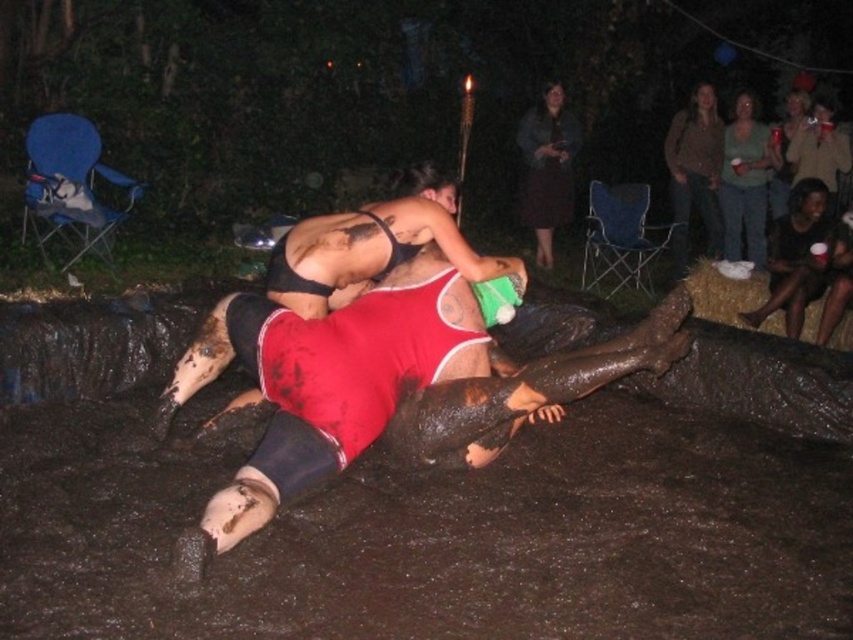
You are a photographer at the campsite and want to capture a photo of the wrestling match. You need to ensure both the black matte bikini top at center and the brown textured sweater at upper right are visible in the frame. Based on their positions, which object should you focus on first to include both in the shot?

You should focus on the black matte bikini top at center first because it is positioned to the left of the brown textured sweater at upper right, so capturing the left side first will help include both in the frame.

You are organizing a costume party and need to decide which outfit to wear. You have the dark brown fabric dress at upper center and the brown textured sweater at upper right. Which one offers more coverage?

The dark brown fabric dress at upper center offers more coverage since it is bigger than the brown textured sweater at upper right.